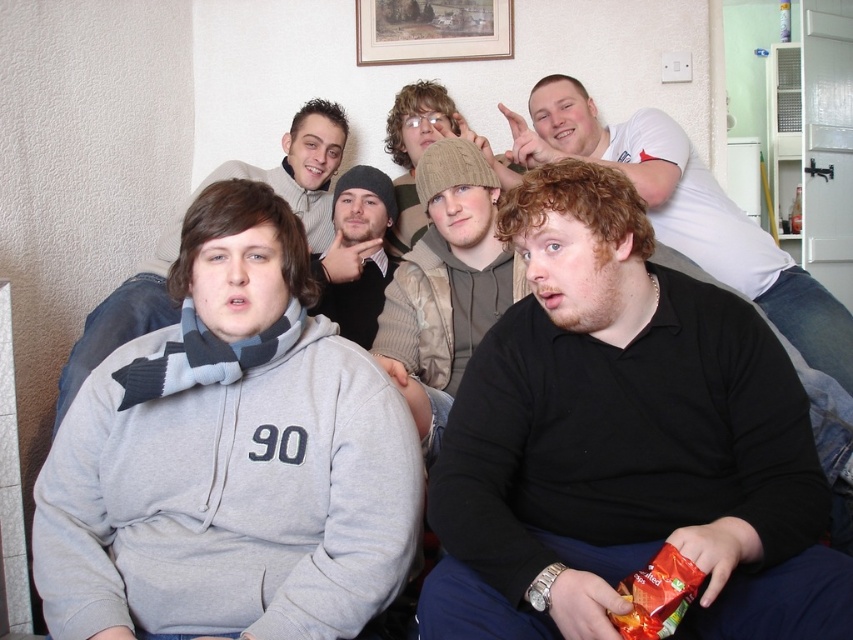
You are a photographer trying to capture a candid shot of the black knit cap at center without the gray fleece hoodie at left blocking it. Based on their positions, is this possible?

The gray fleece hoodie at left is in front of the black knit cap at center, so it would block the view. To capture the black knit cap at center without obstruction, you would need to reposition yourself or the subjects to move the gray fleece hoodie at left out of the way.

You are standing in the living room and want to hand a gift to the person wearing the black knit cap at center without disturbing the person in the gray fleece hoodie at center. Which direction should you approach from?

You should approach from the right side of the black knit cap at center since the gray fleece hoodie at center is to the left of it, so moving from the right avoids disturbing the person in the gray fleece hoodie at center.

You are a photographer standing 1 meter away from the gray fleece hoodie at left and the black knit cap at center. Can you fit both of them in your camera frame if your camera has a 1.2 meter wide field of view?

The gray fleece hoodie at left and black knit cap at center are 96.01 centimeters apart. Since your camera has a 1.2 meter wide field of view, which is wider than the distance between them, you can fit both of them in the frame.